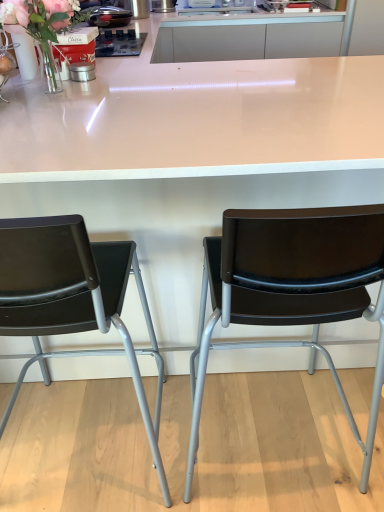
You are a GUI agent. You are given a task and a screenshot of the screen. Output one action in this format:
    pyautogui.click(x=<x>, y=<y>)
    Task: Click on the free spot below translucent glass vase at upper left (from a real-world perspective)
    Image resolution: width=384 pixels, height=512 pixels.
    Given the screenshot: What is the action you would take?
    pyautogui.click(x=56, y=85)